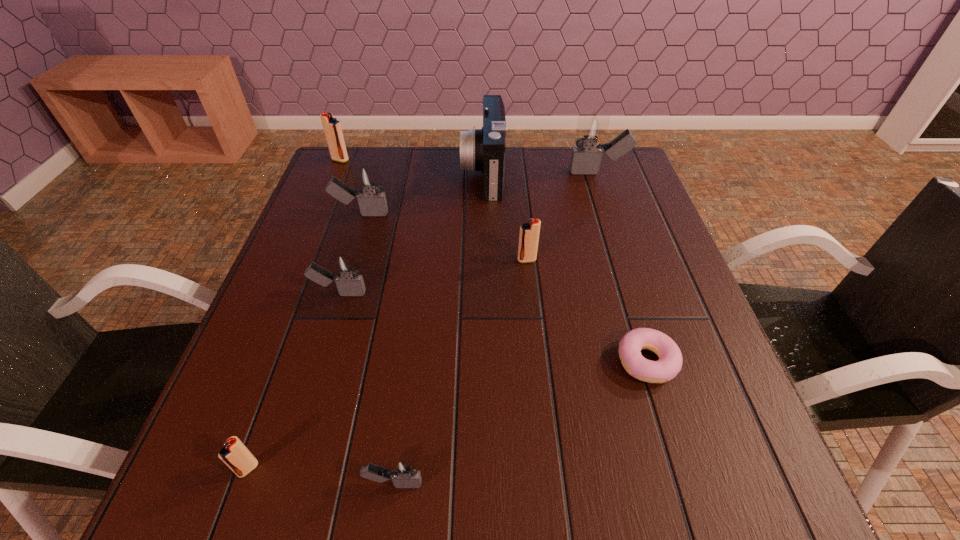
Where is `igniter that is at the right edge`? This screenshot has width=960, height=540. igniter that is at the right edge is located at coordinates (591, 130).

This screenshot has height=540, width=960. Identify the location of doughnut located in the right edge section of the desktop. (669, 364).

Locate an element on the screen. object located at the far left corner is located at coordinates (332, 128).

You are a GUI agent. You are given a task and a screenshot of the screen. Output one action in this format:
    pyautogui.click(x=<x>, y=<y>)
    Task: Click on the object present at the near left corner
    This screenshot has height=540, width=960.
    Given the screenshot: What is the action you would take?
    (234, 454)

What are the coordinates of `object located at the far right corner` in the screenshot? It's located at (591, 130).

The width and height of the screenshot is (960, 540). Identify the location of vacant space at the far edge of the desktop. (460, 168).

The image size is (960, 540). What are the coordinates of `blank space at the near edge` in the screenshot? It's located at (648, 514).

The height and width of the screenshot is (540, 960). What are the coordinates of `free space at the left edge of the desktop` in the screenshot? It's located at (344, 220).

Locate an element on the screen. free space at the right edge is located at coordinates (636, 286).

In the image, there is a desktop. Identify the location of free space at the near left corner. This screenshot has height=540, width=960. (x=286, y=484).